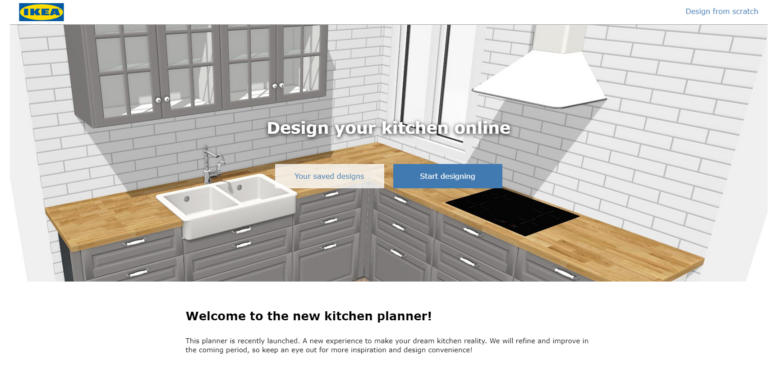
The width and height of the screenshot is (768, 382). I want to click on vent hood, so click(541, 75).